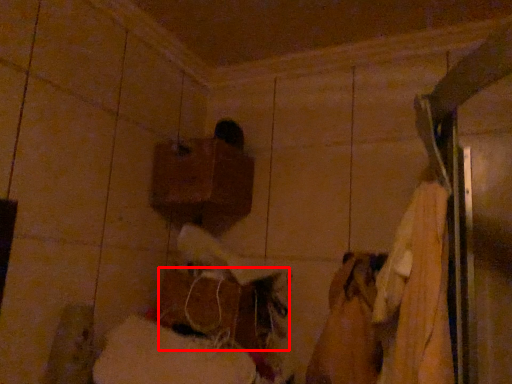
Question: From the image, what is the correct spatial relationship of wood (annotated by the red box) in relation to wood?

Choices:
 (A) left
 (B) right

Answer: (B)